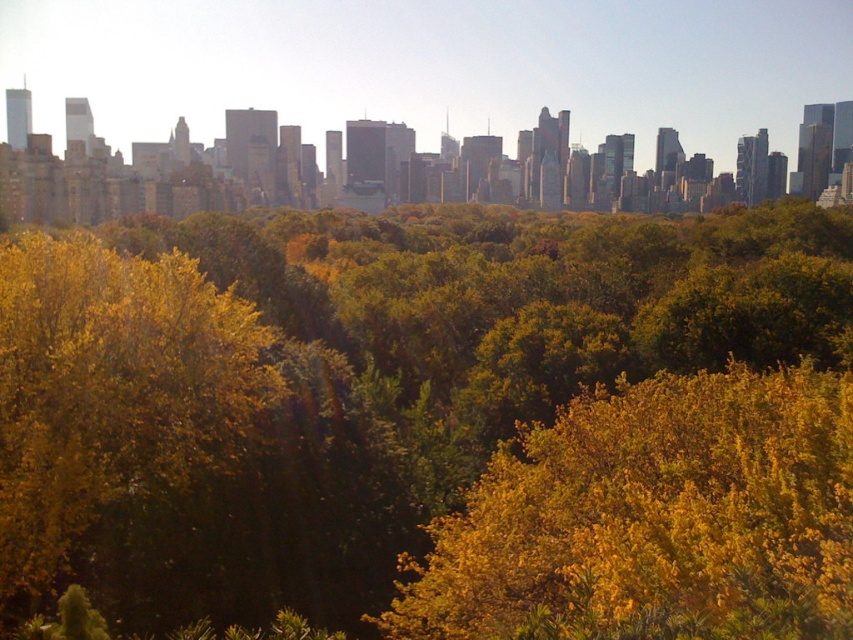
In the scene shown: Between golden textured leaves at center and yellow leafy tree at left, which one appears on the right side from the viewer's perspective?

From the viewer's perspective, golden textured leaves at center appears more on the right side.

Locate an element on the screen. The width and height of the screenshot is (853, 640). golden textured leaves at center is located at coordinates (654, 518).

Which is above, yellow-green foliage at center or yellow leafy tree at left?

yellow-green foliage at center

Is point (323, 250) positioned behind point (245, 442)?

Yes.

Find the location of a particular element. yellow-green foliage at center is located at coordinates (343, 381).

Does yellow-green foliage at center have a greater height compared to golden textured leaves at center?

Indeed, yellow-green foliage at center has a greater height compared to golden textured leaves at center.

Between yellow-green foliage at center and golden textured leaves at center, which one is positioned higher?

yellow-green foliage at center

Does point (343, 456) come behind point (505, 472)?

No.

Locate an element on the screen. This screenshot has width=853, height=640. yellow-green foliage at center is located at coordinates (343, 381).